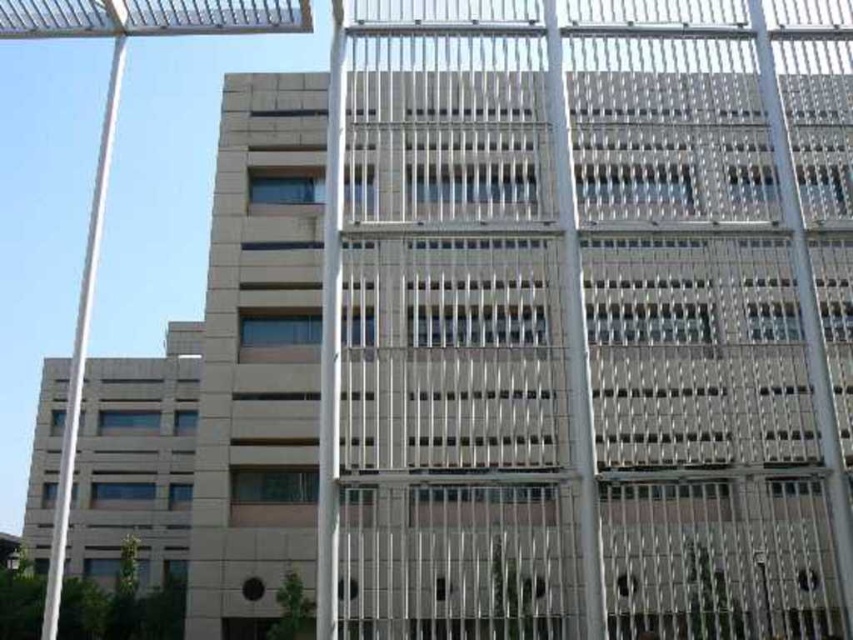
You are standing in front of a modern building with two poles in view. The metallic silver pole at center and the white metallic pole at left. Which pole is shorter?

The metallic silver pole at center is shorter than the white metallic pole at left.